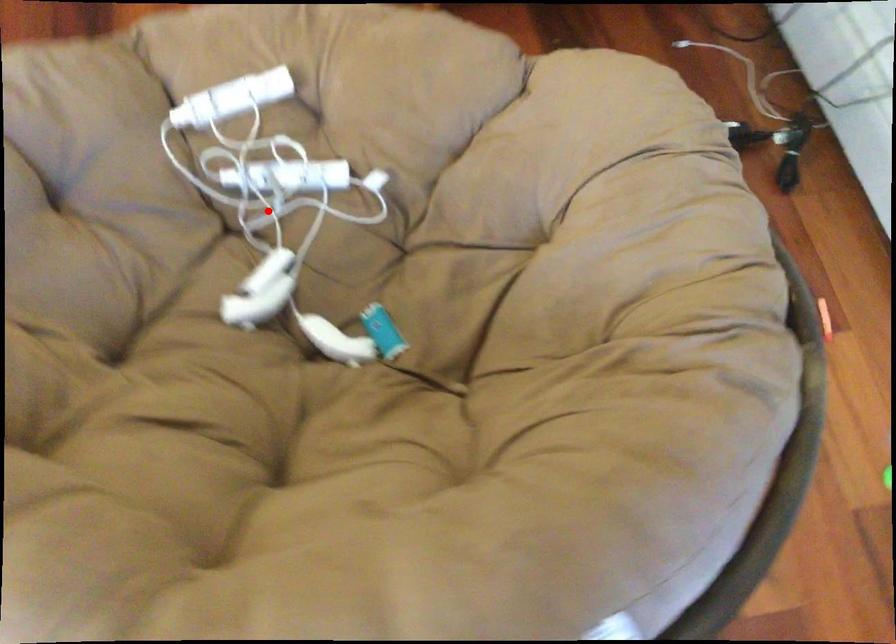
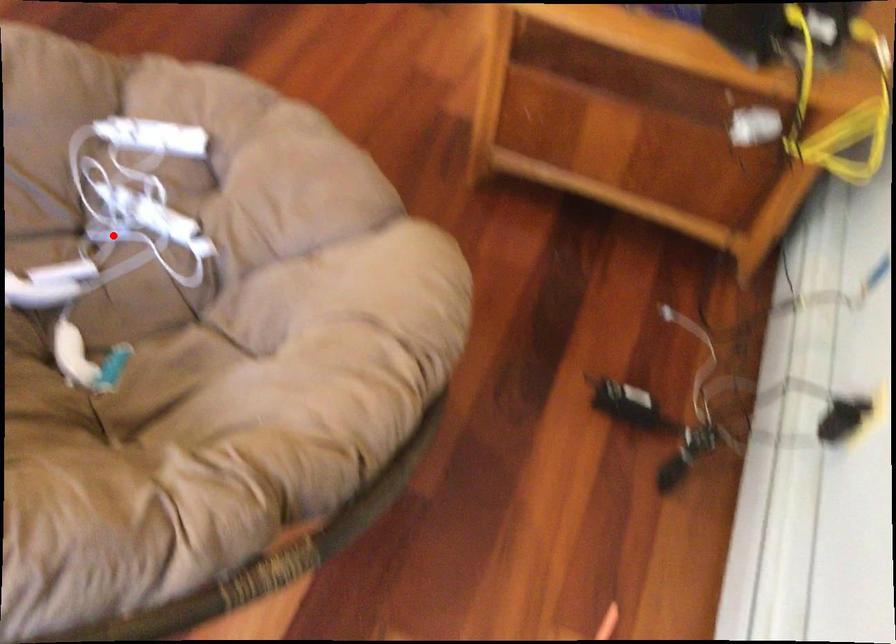
I am providing you with two images of the same scene from different viewpoints. A red point is marked on the first image and another point is marked on the second image. Is the red point in image1 aligned with the point shown in image2?

Yes